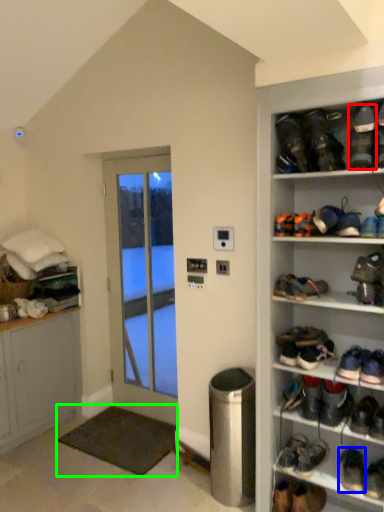
Question: Which object is positioned farthest from footwear (highlighted by a red box)? Select from footwear (highlighted by a blue box) and carpetrack (highlighted by a green box).

Choices:
 (A) footwear
 (B) carpetrack

Answer: (B)